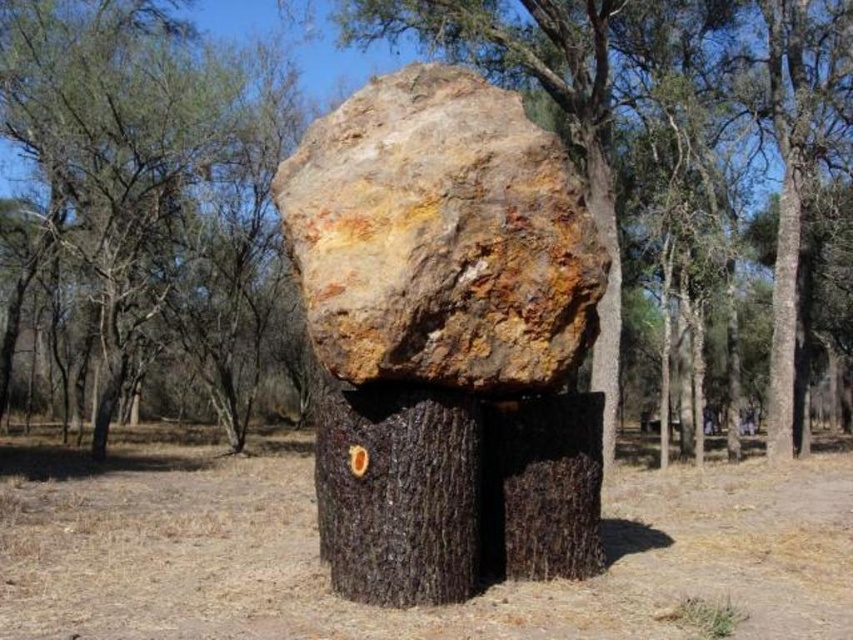
How far apart are brown rough bark at center and rusty stone boulder at center?

brown rough bark at center is 12.81 meters from rusty stone boulder at center.

Between brown rough bark at center and rusty stone boulder at center, which one has more height?

brown rough bark at center is taller.

Is point (97, 128) closer to viewer compared to point (587, 220)?

That is False.

The height and width of the screenshot is (640, 853). In order to click on brown rough bark at center in this screenshot , I will do `click(155, 188)`.

Does brown rough bark at center appear over brown rough tree trunk at right?

Correct, brown rough bark at center is located above brown rough tree trunk at right.

Which is below, brown rough bark at center or brown rough tree trunk at right?

brown rough tree trunk at right

In order to click on brown rough bark at center in this screenshot , I will do `click(155, 188)`.

Can you confirm if brown rough tree trunk at center is positioned to the left of brown rough tree trunk at right?

Correct, you'll find brown rough tree trunk at center to the left of brown rough tree trunk at right.

Can you confirm if brown rough tree trunk at center is smaller than brown rough tree trunk at right?

No, brown rough tree trunk at center is not smaller than brown rough tree trunk at right.

Between point (402, 17) and point (775, 333), which one is positioned behind?

Point (402, 17)

The image size is (853, 640). Find the location of `brown rough tree trunk at center`. brown rough tree trunk at center is located at coordinates (650, 108).